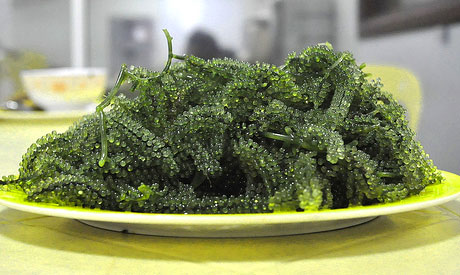
This screenshot has width=460, height=275. Find the location of `light source`. light source is located at coordinates (187, 14).